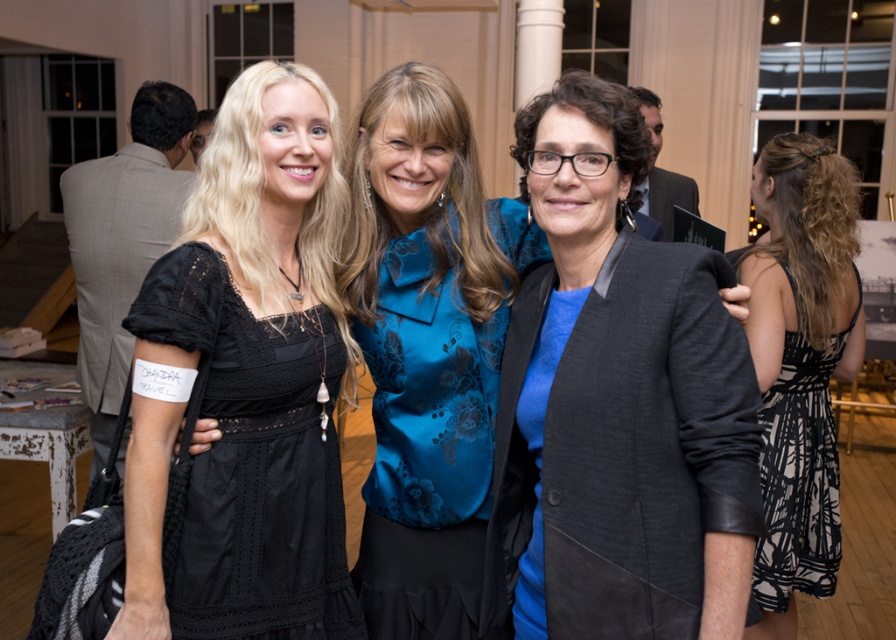
You are a photographer setting up a camera in the background of the scene. You need to adjust the focus so that both the blue satin blouse at center and the black printed fabric dress at right are in clear view. Which object should you focus on first to ensure both are in focus?

The blue satin blouse at center is wider than the black printed fabric dress at right, so focusing on the wider object first will help ensure both are in focus.

You are a photographer setting up for a group photo. You have two items to place on a stand in the background of the scene. The matte black blazer at center and the blue satin blouse at center. The stand can only hold one item. Based on their sizes, which item should you choose to ensure it is visible from a distance?

The matte black blazer at center is much taller than the blue satin blouse at center, so you should choose the matte black blazer at center to ensure it is visible from a distance.

You are a photographer adjusting your camera settings to focus on the two women in the scene. Which one should you focus on first if you want to capture both the matte black blazer at center and the black printed fabric dress at right in sharp detail?

The matte black blazer at center is closer to the viewer than the black printed fabric dress at right, so you should focus on the matte black blazer at center first to ensure both are in sharp detail.